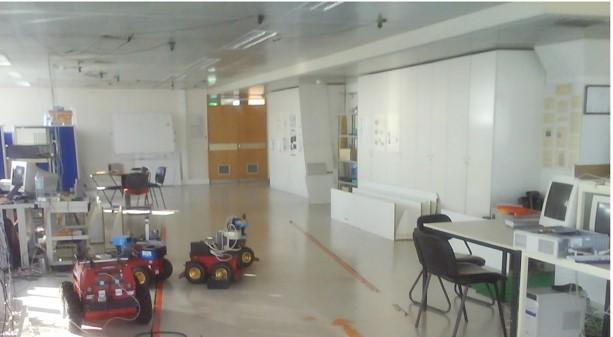
This screenshot has width=613, height=337. Find the location of `floor`. floor is located at coordinates (302, 265).